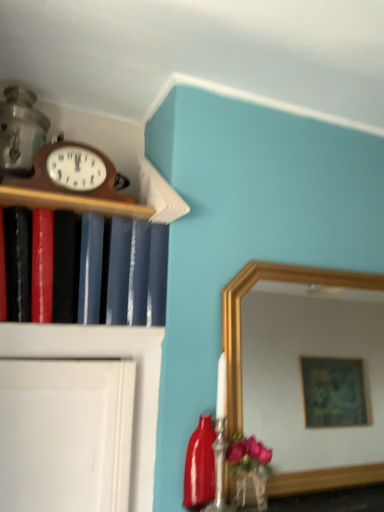
Question: Is woodenmaterial/texture wall clock at upper left to the left of matte black book at left from the viewer's perspective?

Choices:
 (A) no
 (B) yes

Answer: (A)

Question: Is woodenmaterial/texture wall clock at upper left not inside matte black book at left?

Choices:
 (A) yes
 (B) no

Answer: (A)

Question: From a real-world perspective, is woodenmaterial/texture wall clock at upper left beneath matte black book at left?

Choices:
 (A) no
 (B) yes

Answer: (A)

Question: Can you confirm if woodenmaterial/texture wall clock at upper left is taller than matte black book at left?

Choices:
 (A) no
 (B) yes

Answer: (A)

Question: Considering the relative positions of woodenmaterial/texture wall clock at upper left and matte black book at left in the image provided, is woodenmaterial/texture wall clock at upper left in front of matte black book at left?

Choices:
 (A) yes
 (B) no

Answer: (B)

Question: Could you tell me if woodenmaterial/texture wall clock at upper left is facing matte black book at left?

Choices:
 (A) no
 (B) yes

Answer: (A)

Question: Is glossy ceramic bottle at lower right far from wooden clock at upper left?

Choices:
 (A) yes
 (B) no

Answer: (B)

Question: Considering the relative positions of glossy ceramic bottle at lower right and wooden clock at upper left in the image provided, is glossy ceramic bottle at lower right behind wooden clock at upper left?

Choices:
 (A) no
 (B) yes

Answer: (B)

Question: Is glossy ceramic bottle at lower right at the right side of wooden clock at upper left?

Choices:
 (A) yes
 (B) no

Answer: (A)

Question: Can you confirm if glossy ceramic bottle at lower right is shorter than wooden clock at upper left?

Choices:
 (A) no
 (B) yes

Answer: (A)

Question: Is glossy ceramic bottle at lower right smaller than wooden clock at upper left?

Choices:
 (A) yes
 (B) no

Answer: (A)

Question: From a real-world perspective, is glossy ceramic bottle at lower right located beneath wooden clock at upper left?

Choices:
 (A) yes
 (B) no

Answer: (A)

Question: Can you confirm if glossy ceramic bottle at lower right is positioned to the left of woodenmaterial/texture wall clock at upper left?

Choices:
 (A) no
 (B) yes

Answer: (A)